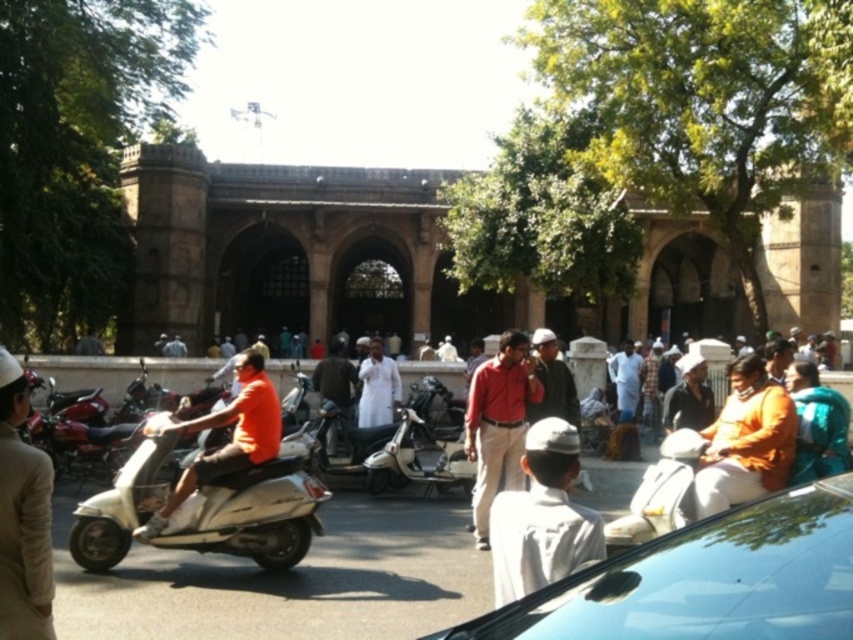
Question: Among these objects, which one is nearest to the camera?

Choices:
 (A) matte red shirt at center
 (B) teal fabric shawl at right
 (C) orange cotton shirt at right
 (D) white cotton shirt at lower center

Answer: (D)

Question: Does white glossy scooter at center appear over orange cotton shirt at right?

Choices:
 (A) no
 (B) yes

Answer: (A)

Question: Does shiny blue car at lower right appear on the right side of white cotton shirt at lower center?

Choices:
 (A) yes
 (B) no

Answer: (A)

Question: Which of the following is the farthest from the observer?

Choices:
 (A) (149, 253)
 (B) (727, 602)

Answer: (A)

Question: Which object is the farthest from the white cotton shirt at lower center?

Choices:
 (A) white glossy scooter at center
 (B) brown stone building at center
 (C) orange cotton shirt at right

Answer: (B)

Question: Considering the relative positions of orange t-shirt at center and teal fabric shawl at right in the image provided, where is orange t-shirt at center located with respect to teal fabric shawl at right?

Choices:
 (A) above
 (B) below

Answer: (B)